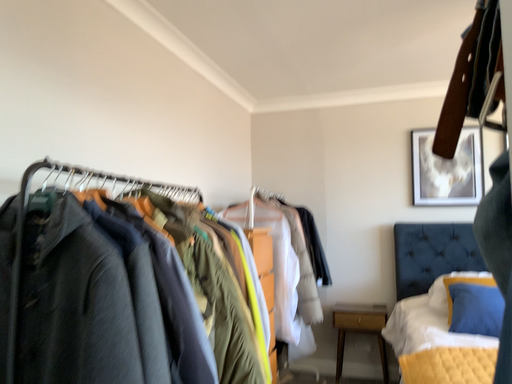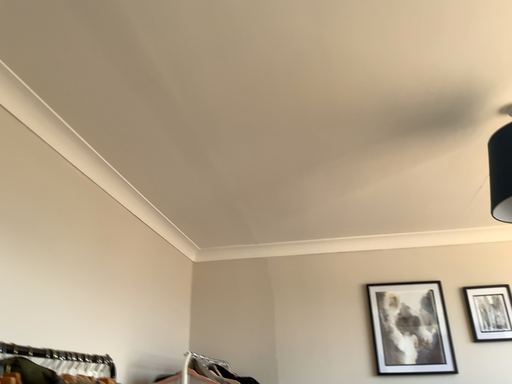
Question: Which way did the camera rotate in the video?

Choices:
 (A) rotated left
 (B) rotated right

Answer: (B)